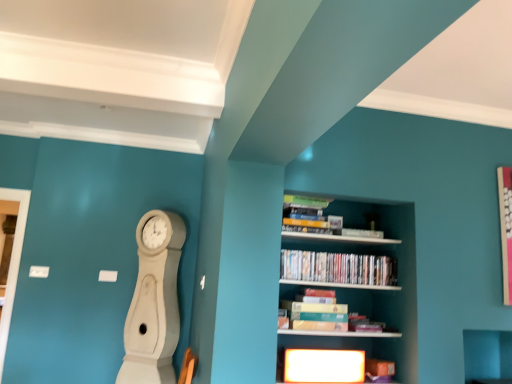
What do you see at coordinates (154, 301) in the screenshot?
I see `white wood clock at left` at bounding box center [154, 301].

Where is `white wood clock at left`? The image size is (512, 384). white wood clock at left is located at coordinates (154, 301).

Find the location of a particular element. The image size is (512, 384). shelf below the matte plastic dvds at center, placed as the first book when sorted from top to bottom (from the image's perspective) is located at coordinates (374, 288).

In the scene shown: Is matte plastic dvds at center, acting as the second book starting from the bottom, not within wooden bookshelf at center?

Actually, matte plastic dvds at center, acting as the second book starting from the bottom, is within wooden bookshelf at center.

How many degrees apart are the facing directions of matte plastic dvds at center, placed as the first book when sorted from top to bottom, and wooden bookshelf at center?

There is a 3.81-degree angle between the facing directions of matte plastic dvds at center, placed as the first book when sorted from top to bottom, and wooden bookshelf at center.

From the image's perspective, is matte plastic dvds at center, placed as the first book when sorted from top to bottom, located beneath wooden bookshelf at center?

No.

From a real-world perspective, is wooden bookshelf at center positioned above or below matte plastic dvds at center, placed as the first book when sorted from top to bottom?

From a real-world perspective, wooden bookshelf at center is physically below matte plastic dvds at center, placed as the first book when sorted from top to bottom.

Considering the relative positions of wooden bookshelf at center and matte plastic dvds at center, placed as the first book when sorted from top to bottom, in the image provided, is wooden bookshelf at center to the right of matte plastic dvds at center, placed as the first book when sorted from top to bottom, from the viewer's perspective?

No.

Is point (405, 215) positioned in front of point (389, 261)?

Yes, it is.

In the scene shown: Which of these two, wooden bookshelf at center or matte plastic dvds at center, placed as the first book when sorted from top to bottom, stands taller?

wooden bookshelf at center.

From a real-world perspective, is wooden bookshelf at center beneath matte cardboard book at center, which appears as the first book when ordered from the bottom?

No.

Is matte cardboard book at center, placed as the second book when sorted from top to bottom, surrounded by wooden bookshelf at center?

Yes, matte cardboard book at center, placed as the second book when sorted from top to bottom, is surrounded by wooden bookshelf at center.

Considering the relative positions of wooden bookshelf at center and matte cardboard book at center, which appears as the first book when ordered from the bottom, in the image provided, is wooden bookshelf at center to the left of matte cardboard book at center, which appears as the first book when ordered from the bottom, from the viewer's perspective?

No.

Can you confirm if wooden bookshelf at center is shorter than matte cardboard book at center, placed as the second book when sorted from top to bottom?

Incorrect, the height of wooden bookshelf at center does not fall short of that of matte cardboard book at center, placed as the second book when sorted from top to bottom.

How different are the orientations of matte plastic dvds at center, placed as the first book when sorted from top to bottom, and white wood clock at left in degrees?

matte plastic dvds at center, placed as the first book when sorted from top to bottom, and white wood clock at left are facing 5.13 degrees away from each other.

Consider the image. Is matte plastic dvds at center, acting as the second book starting from the bottom, positioned behind white wood clock at left?

No, it is in front of white wood clock at left.

From a real-world perspective, does matte plastic dvds at center, placed as the first book when sorted from top to bottom, sit lower than white wood clock at left?

No.

Which is behind, point (324, 272) or point (170, 255)?

The point (170, 255) is behind.

From a real-world perspective, does matte cardboard book at center, which appears as the first book when ordered from the bottom, stand above wooden bookshelf at center?

No.

Is matte cardboard book at center, which appears as the first book when ordered from the bottom, far from wooden bookshelf at center?

No, there isn't a large distance between matte cardboard book at center, which appears as the first book when ordered from the bottom, and wooden bookshelf at center.

Which of these two, matte cardboard book at center, which appears as the first book when ordered from the bottom, or wooden bookshelf at center, stands shorter?

matte cardboard book at center, which appears as the first book when ordered from the bottom, is shorter.

Image resolution: width=512 pixels, height=384 pixels. In the image, there is a wooden bookshelf at center. Find the location of `book below it (from the image's perspective)`. book below it (from the image's perspective) is located at coordinates (323, 316).

Considering the sizes of white wood clock at left and matte cardboard book at center, which appears as the first book when ordered from the bottom, in the image, is white wood clock at left taller or shorter than matte cardboard book at center, which appears as the first book when ordered from the bottom,?

Clearly, white wood clock at left is taller compared to matte cardboard book at center, which appears as the first book when ordered from the bottom.

Between white wood clock at left and matte cardboard book at center, which appears as the first book when ordered from the bottom, which one is positioned behind?

white wood clock at left is further away from the camera.

How many degrees apart are the facing directions of white wood clock at left and matte cardboard book at center, placed as the second book when sorted from top to bottom?

They differ by 5.13 degrees in their facing directions.

Are white wood clock at left and matte cardboard book at center, placed as the second book when sorted from top to bottom, located far from each other?

Yes, white wood clock at left and matte cardboard book at center, placed as the second book when sorted from top to bottom, are quite far apart.

In the scene shown: From a real-world perspective, is white wood clock at left positioned over matte plastic dvds at center, acting as the second book starting from the bottom, based on gravity?

No.

Starting from the white wood clock at left, which book is the 2nd one to the right? Please provide its 2D coordinates.

[(338, 268)]

Is white wood clock at left taller or shorter than matte plastic dvds at center, acting as the second book starting from the bottom?

Clearly, white wood clock at left is taller compared to matte plastic dvds at center, acting as the second book starting from the bottom.

At what (x,y) coordinates should I click in order to perform the action: click on shelf below the matte plastic dvds at center, placed as the first book when sorted from top to bottom (from the image's perspective). Please return your answer as a coordinate pair (x, y). The width and height of the screenshot is (512, 384). Looking at the image, I should click on (374, 288).

This screenshot has width=512, height=384. I want to click on book that appears above the wooden bookshelf at center (from a real-world perspective), so click(338, 268).

Estimate the real-world distances between objects in this image. Which object is further from white wood clock at left, wooden bookshelf at center or matte plastic dvds at center, placed as the first book when sorted from top to bottom?

wooden bookshelf at center is further to white wood clock at left.

When comparing their distances from wooden bookshelf at center, does matte plastic dvds at center, acting as the second book starting from the bottom, or matte cardboard book at center, placed as the second book when sorted from top to bottom, seem closer?

matte plastic dvds at center, acting as the second book starting from the bottom.

From the image, which object appears to be farther from wooden bookshelf at center, matte plastic dvds at center, acting as the second book starting from the bottom, or white wood clock at left?

Based on the image, white wood clock at left appears to be further to wooden bookshelf at center.

Based on their spatial positions, is matte plastic dvds at center, acting as the second book starting from the bottom, or white wood clock at left closer to matte cardboard book at center, placed as the second book when sorted from top to bottom?

matte plastic dvds at center, acting as the second book starting from the bottom, is closer to matte cardboard book at center, placed as the second book when sorted from top to bottom.

When comparing their distances from matte plastic dvds at center, acting as the second book starting from the bottom, does wooden bookshelf at center or matte cardboard book at center, which appears as the first book when ordered from the bottom, seem further?

The object further to matte plastic dvds at center, acting as the second book starting from the bottom, is matte cardboard book at center, which appears as the first book when ordered from the bottom.

From the image, which object appears to be farther from wooden bookshelf at center, white wood clock at left or matte cardboard book at center, placed as the second book when sorted from top to bottom?

white wood clock at left lies further to wooden bookshelf at center than the other object.

Considering their positions, is wooden bookshelf at center positioned further to white wood clock at left than matte cardboard book at center, placed as the second book when sorted from top to bottom?

wooden bookshelf at center lies further to white wood clock at left than the other object.

Based on their spatial positions, is white wood clock at left or wooden bookshelf at center further from matte plastic dvds at center, placed as the first book when sorted from top to bottom?

Based on the image, white wood clock at left appears to be further to matte plastic dvds at center, placed as the first book when sorted from top to bottom.

The width and height of the screenshot is (512, 384). Find the location of `book between white wood clock at left and matte plastic dvds at center, placed as the first book when sorted from top to bottom, in the horizontal direction`. book between white wood clock at left and matte plastic dvds at center, placed as the first book when sorted from top to bottom, in the horizontal direction is located at coordinates 323,316.

Locate an element on the screen. The image size is (512, 384). shelf between white wood clock at left and matte plastic dvds at center, placed as the first book when sorted from top to bottom is located at coordinates click(x=374, y=288).

This screenshot has height=384, width=512. Identify the location of book between white wood clock at left and wooden bookshelf at center in the horizontal direction. (323, 316).

The image size is (512, 384). What are the coordinates of `book between wooden bookshelf at center and matte plastic dvds at center, placed as the first book when sorted from top to bottom, along the z-axis` in the screenshot? It's located at 323,316.